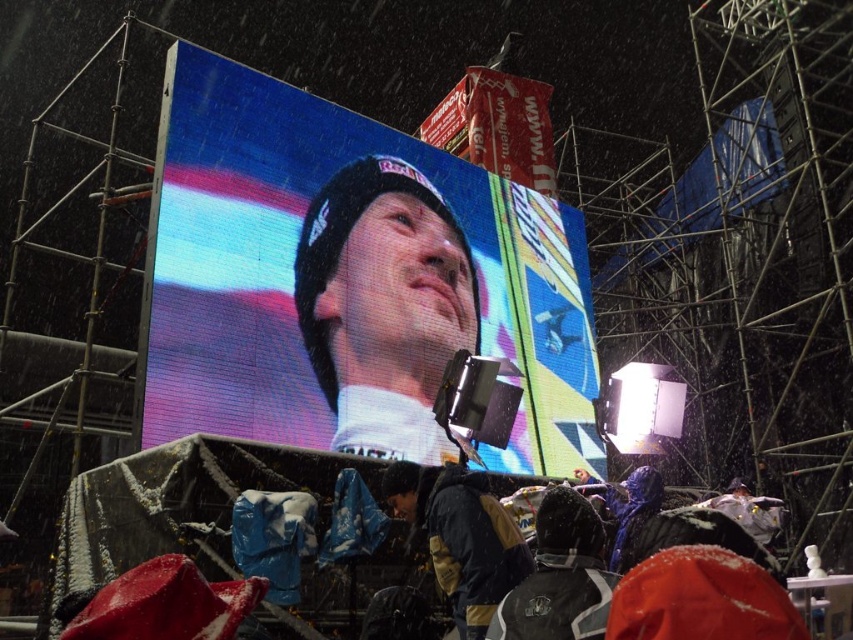
Locate an element on the screen. This screenshot has width=853, height=640. led display at center is located at coordinates (347, 280).

Describe the element at coordinates (347, 280) in the screenshot. I see `led display at center` at that location.

You are a GUI agent. You are given a task and a screenshot of the screen. Output one action in this format:
    pyautogui.click(x=<x>, y=<y>)
    Task: Click on the led display at center
    
    Given the screenshot: What is the action you would take?
    pyautogui.click(x=347, y=280)

Between matte black beanie at center and dark blue jacket at center, which one appears on the left side from the viewer's perspective?

matte black beanie at center is more to the left.

Does point (341, 406) come in front of point (447, 556)?

No, (341, 406) is behind (447, 556).

Between point (471, 266) and point (524, 547), which one is positioned behind?

The point (471, 266) is behind.

The image size is (853, 640). I want to click on matte black beanie at center, so click(x=383, y=298).

Is dark blue jacket at center to the right of dark gray jacket at lower center from the viewer's perspective?

Incorrect, dark blue jacket at center is not on the right side of dark gray jacket at lower center.

Who is more forward, (448, 572) or (584, 525)?

Positioned in front is point (584, 525).

Locate an element on the screen. dark blue jacket at center is located at coordinates (461, 538).